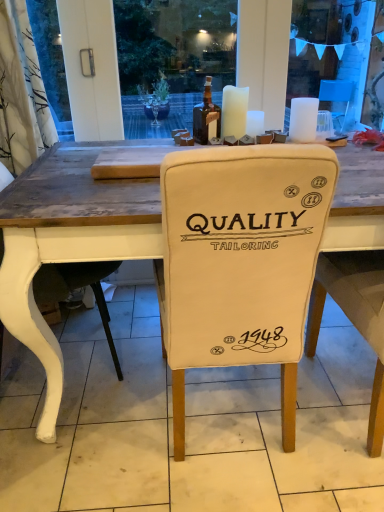
The width and height of the screenshot is (384, 512). I want to click on vacant region below white fabric chair at left (from a real-world perspective), so click(70, 376).